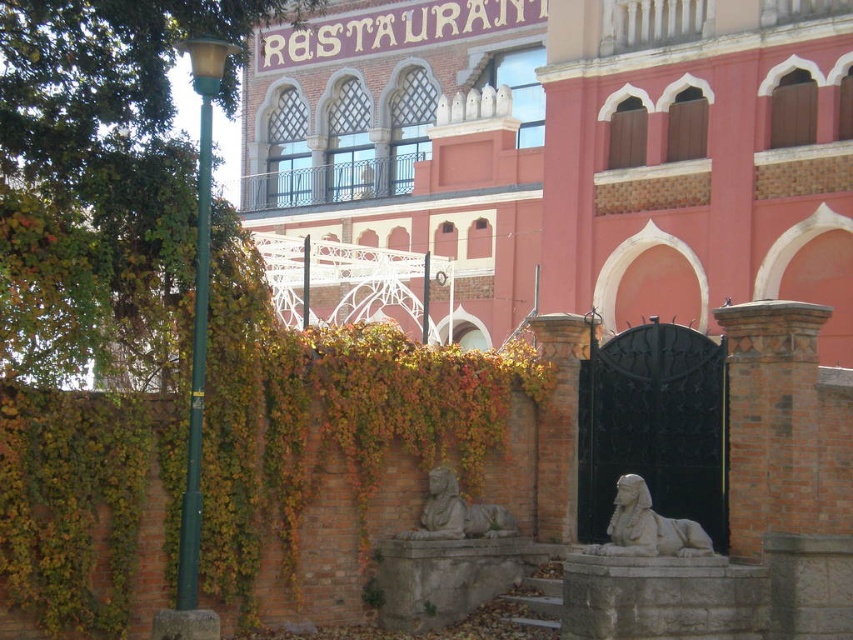
Question: Which of the following is the farthest from the observer?

Choices:
 (A) white stone sphinx at lower right
 (B) gray stone sphinx at center
 (C) smooth stone sphinxes at center

Answer: (B)

Question: Does white stone sphinx at lower right appear over gray stone sphinx at center?

Choices:
 (A) no
 (B) yes

Answer: (B)

Question: Which point appears closest to the camera in this image?

Choices:
 (A) (448, 506)
 (B) (323, 305)
 (C) (637, 515)

Answer: (C)

Question: Which of these objects is positioned closest to the white stone sphinx at lower right?

Choices:
 (A) smooth stone sphinxes at center
 (B) gray stone sphinx at center

Answer: (B)

Question: Is white stone sphinx at lower right further to the viewer compared to gray stone sphinx at center?

Choices:
 (A) no
 (B) yes

Answer: (A)

Question: Does smooth stone sphinxes at center lie behind white stone sphinx at lower right?

Choices:
 (A) yes
 (B) no

Answer: (A)